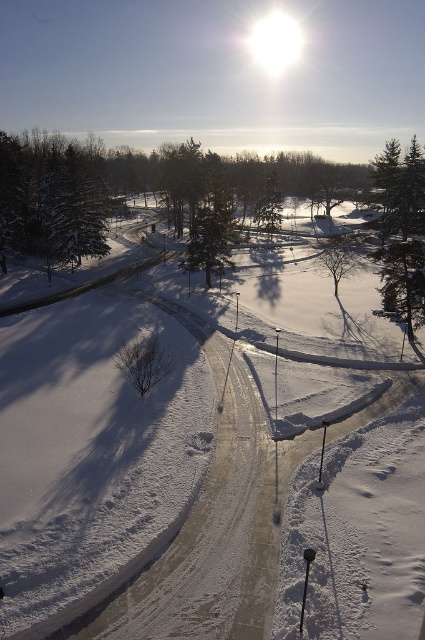
Based on the photo, how much distance is there between white snow at center and green textured pine tree at right?

They are 89.68 feet apart.

Can you confirm if white snow at center is smaller than green textured pine tree at right?

Yes.

The image size is (425, 640). What do you see at coordinates (141, 467) in the screenshot?
I see `white snow at center` at bounding box center [141, 467].

Where is `white snow at center`? white snow at center is located at coordinates (x=141, y=467).